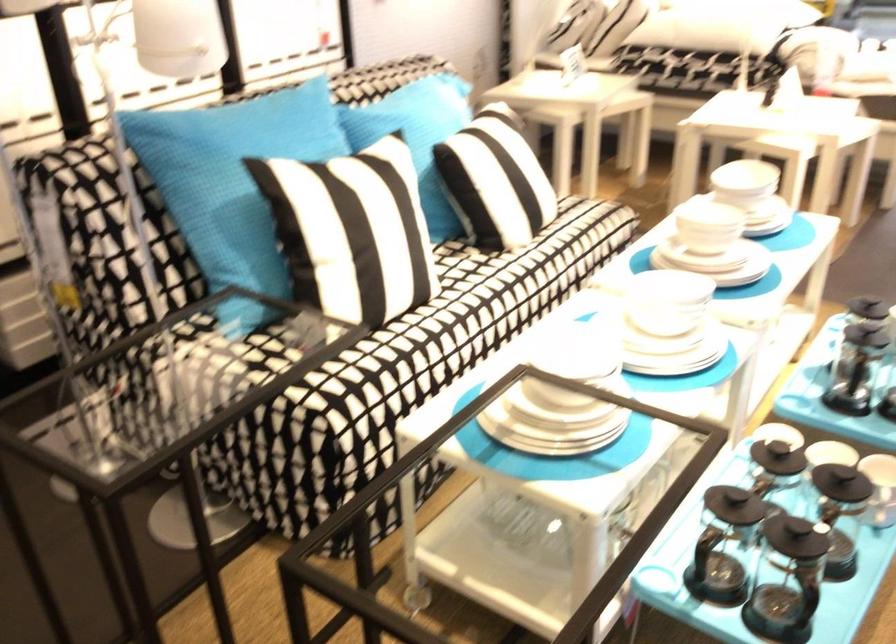
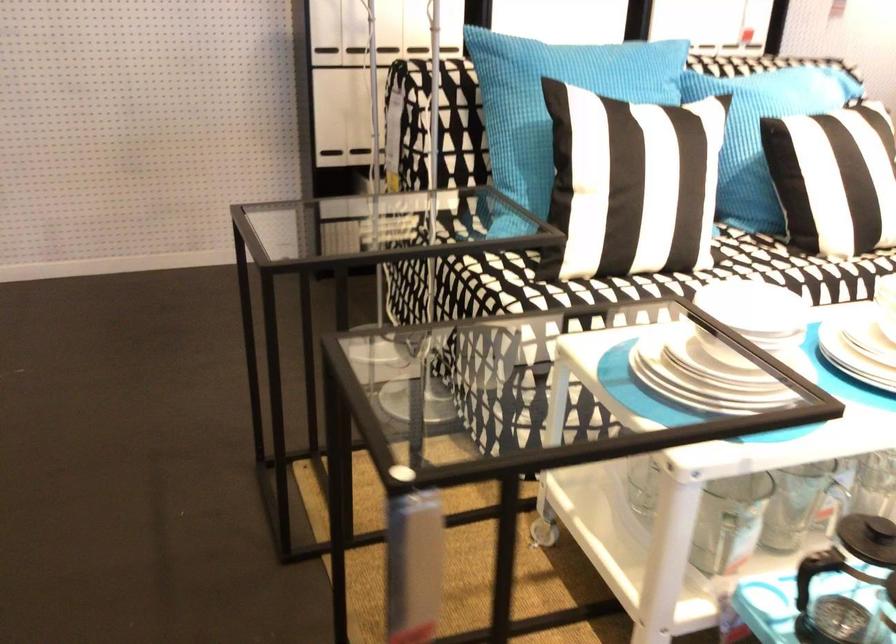
Find the pixel in the second image that matches (x=487, y=269) in the first image.

(782, 263)